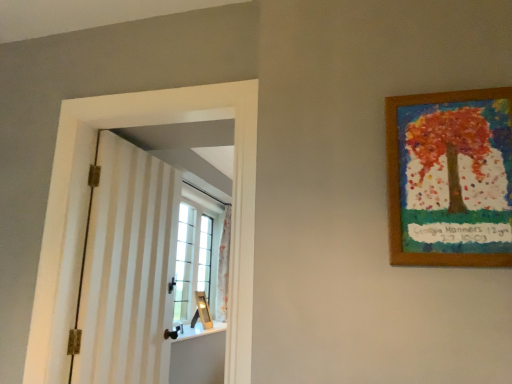
Question: Is beige striped barn door at left to the right of wooden picture frame at upper right from the viewer's perspective?

Choices:
 (A) no
 (B) yes

Answer: (A)

Question: Could wooden picture frame at upper right be considered to be inside beige striped barn door at left?

Choices:
 (A) yes
 (B) no

Answer: (B)

Question: Does beige striped barn door at left have a lesser width compared to wooden picture frame at upper right?

Choices:
 (A) no
 (B) yes

Answer: (A)

Question: Is beige striped barn door at left turned away from wooden picture frame at upper right?

Choices:
 (A) yes
 (B) no

Answer: (B)

Question: From a real-world perspective, does beige striped barn door at left stand above wooden picture frame at upper right?

Choices:
 (A) yes
 (B) no

Answer: (B)

Question: From a real-world perspective, is beige striped barn door at left located beneath wooden picture frame at upper right?

Choices:
 (A) yes
 (B) no

Answer: (A)

Question: Is wooden picture frame at upper right wider than beige striped barn door at left?

Choices:
 (A) no
 (B) yes

Answer: (A)

Question: Does wooden picture frame at upper right appear on the left side of beige striped barn door at left?

Choices:
 (A) no
 (B) yes

Answer: (A)

Question: From the image's perspective, is wooden picture frame at upper right above beige striped barn door at left?

Choices:
 (A) no
 (B) yes

Answer: (B)

Question: From a real-world perspective, is wooden picture frame at upper right on beige striped barn door at left?

Choices:
 (A) yes
 (B) no

Answer: (A)

Question: Can we say wooden picture frame at upper right lies outside beige striped barn door at left?

Choices:
 (A) yes
 (B) no

Answer: (A)

Question: Is wooden picture frame at upper right taller than beige striped barn door at left?

Choices:
 (A) yes
 (B) no

Answer: (B)

Question: Based on their sizes in the image, would you say beige striped barn door at left is bigger or smaller than wooden picture frame at upper right?

Choices:
 (A) small
 (B) big

Answer: (B)